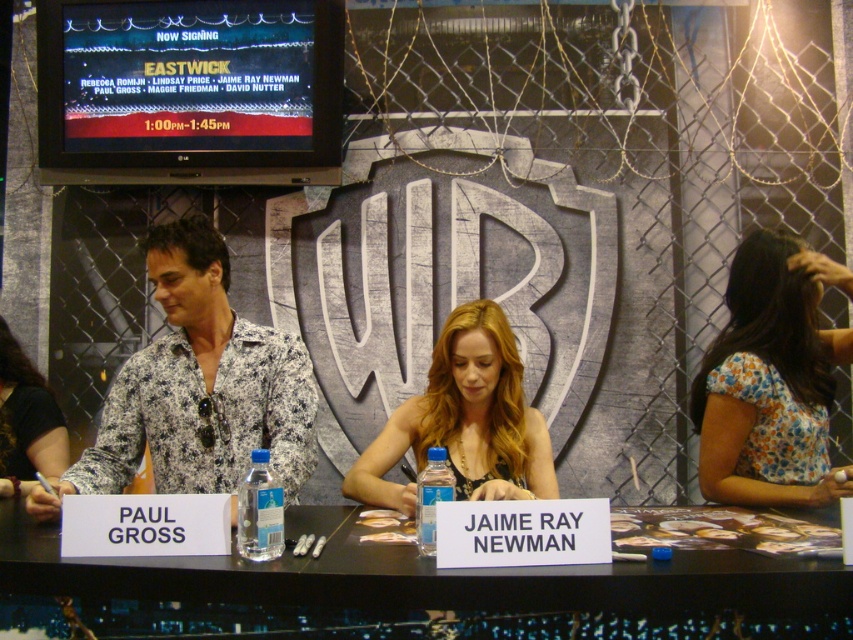
Between blonde hair at center and black fabric shirt at left, which one appears on the left side from the viewer's perspective?

From the viewer's perspective, black fabric shirt at left appears more on the left side.

Which is behind, point (520, 442) or point (62, 420)?

Positioned behind is point (62, 420).

Locate an element on the screen. This screenshot has height=640, width=853. blonde hair at center is located at coordinates (463, 420).

Does white plastic table at center have a larger size compared to floral-patterned shirt at center?

No, white plastic table at center is not bigger than floral-patterned shirt at center.

Who is lower down, white plastic table at center or floral-patterned shirt at center?

white plastic table at center

Does point (756, 577) lie in front of point (270, 378)?

Yes.

At what (x,y) coordinates should I click in order to perform the action: click on white plastic table at center. Please return your answer as a coordinate pair (x, y). This screenshot has width=853, height=640. Looking at the image, I should click on (415, 592).

Describe the element at coordinates (415, 592) in the screenshot. I see `white plastic table at center` at that location.

Which is above, white plastic table at center or blonde hair at center?

blonde hair at center

Is point (705, 564) in front of point (376, 465)?

Yes, point (705, 564) is in front of point (376, 465).

At what (x,y) coordinates should I click in order to perform the action: click on white plastic table at center. Please return your answer as a coordinate pair (x, y). This screenshot has width=853, height=640. Looking at the image, I should click on (415, 592).